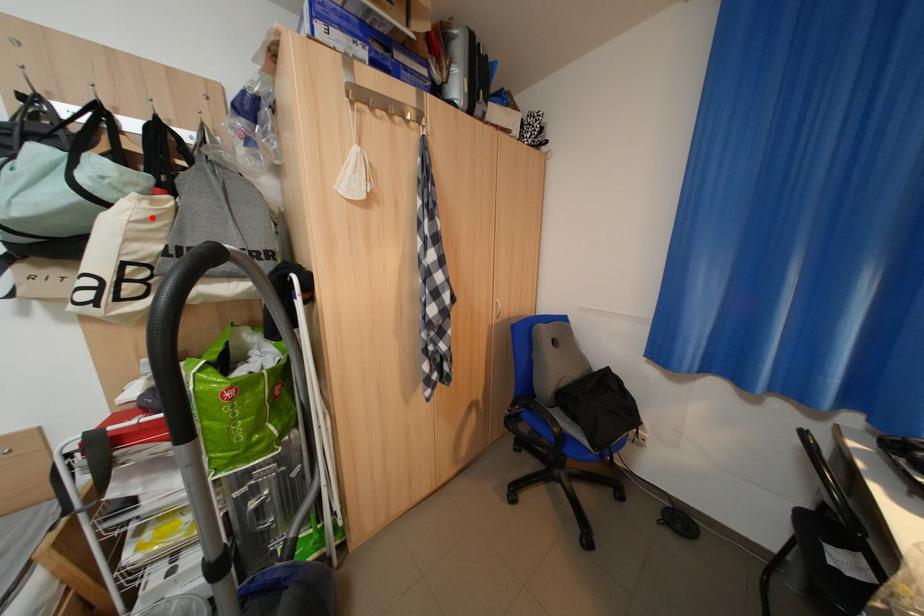
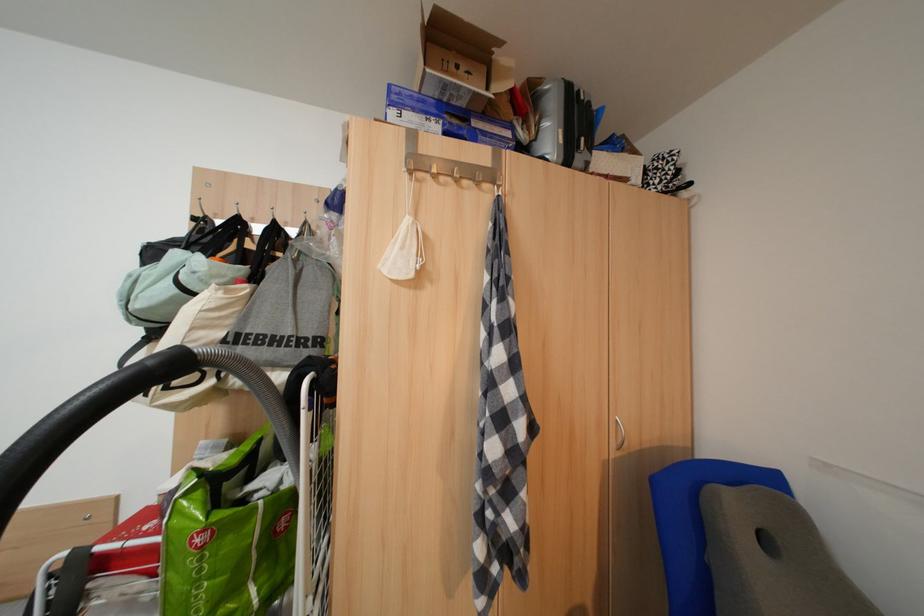
Where in the second image is the point corresponding to the highlighted location from the first image?

(224, 307)